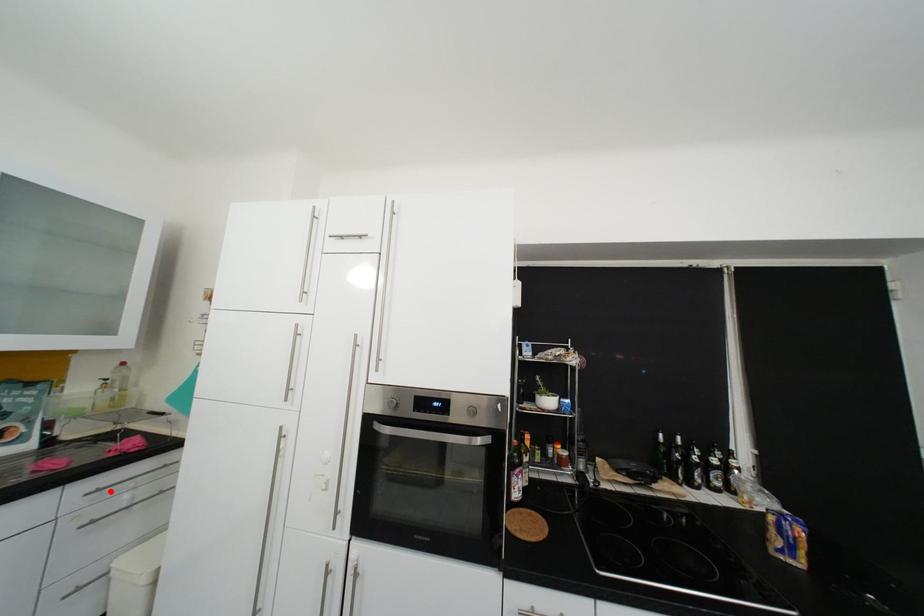
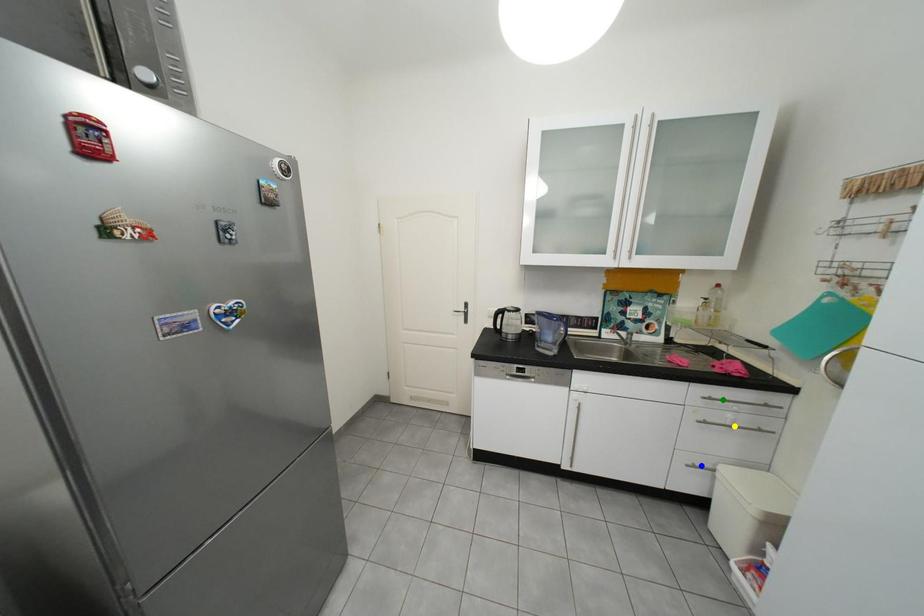
Question: I am providing you with two images of the same scene from different viewpoints. A red point is marked on the first image. You are given multiple points on the second image. Which point in image 2 represents the same 3d spot as the red point in image 1?

Choices:
 (A) yellow point
 (B) green point
 (C) blue point

Answer: (B)